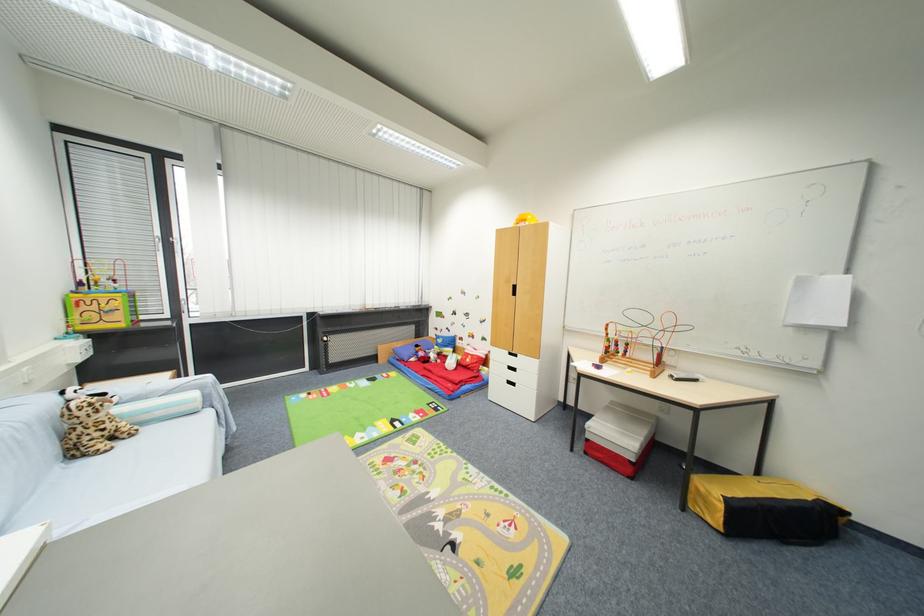
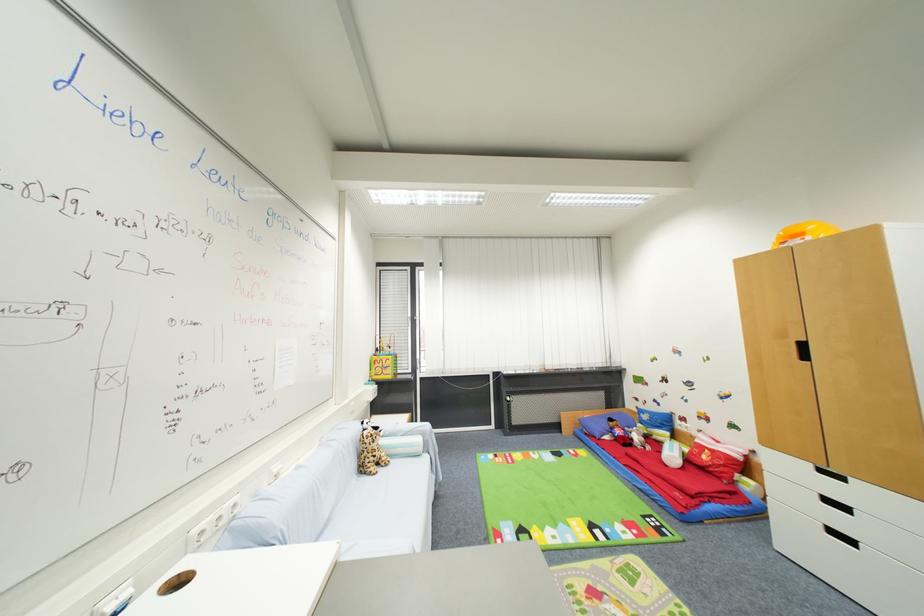
Locate, in the second image, the point that corresponds to pixel 125 446 in the first image.

(385, 472)